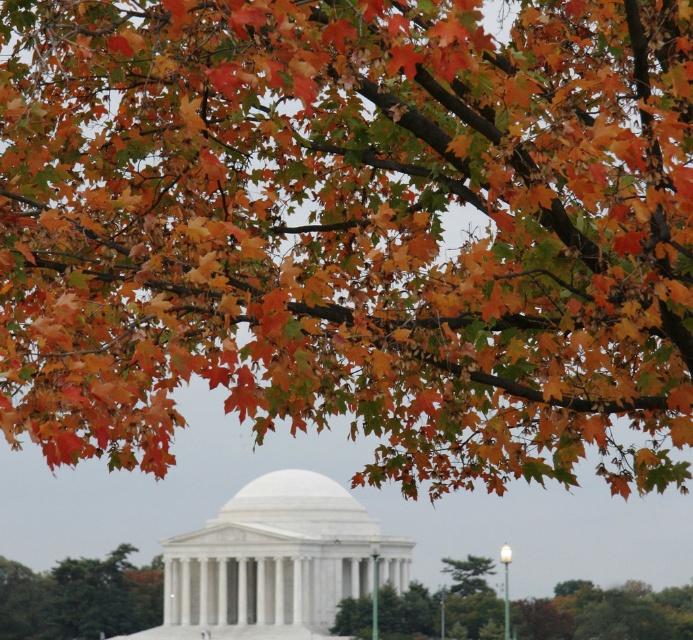
Does green leafy tree at center have a larger size compared to green matte tree at lower left?

Yes.

Is point (535, 621) positioned before point (155, 580)?

Yes, it is.

The image size is (693, 640). Identify the location of green leafy tree at center. [x=604, y=612].

This screenshot has height=640, width=693. What are the coordinates of `white marble gazebo at center` in the screenshot? It's located at (277, 561).

Which is more to the right, white marble gazebo at center or green leafy tree at center?

→ green leafy tree at center

Is point (267, 605) positioned before point (629, 627)?

Yes, point (267, 605) is in front of point (629, 627).

Locate an element on the screen. This screenshot has width=693, height=640. white marble gazebo at center is located at coordinates (277, 561).

Who is shorter, white marble gazebo at center or green matte tree at lower left?

Standing shorter between the two is green matte tree at lower left.

Does white marble gazebo at center come behind green matte tree at lower left?

No.

Describe the element at coordinates (277, 561) in the screenshot. I see `white marble gazebo at center` at that location.

The image size is (693, 640). What are the coordinates of `white marble gazebo at center` in the screenshot? It's located at (277, 561).